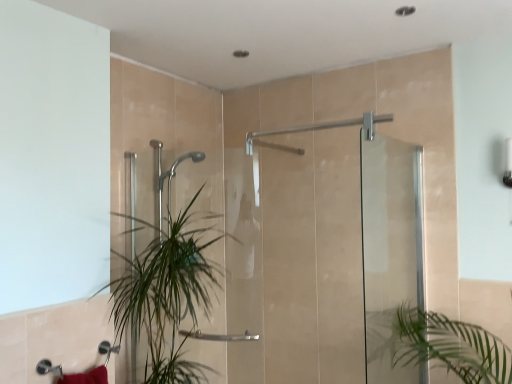
Question: In which direction should I rotate to look at clear glass shower door at center, the first screen door when ordered from left to right?

Choices:
 (A) left
 (B) right

Answer: (A)

Question: From the image's perspective, is transparent glass screen door at right, the 1th screen door in the right-to-left sequence, above green leafy plant at center?

Choices:
 (A) yes
 (B) no

Answer: (A)

Question: From the image's perspective, is transparent glass screen door at right, which is counted as the second screen door, starting from the left, located beneath green leafy plant at center?

Choices:
 (A) yes
 (B) no

Answer: (B)

Question: From a real-world perspective, is transparent glass screen door at right, which is counted as the second screen door, starting from the left, on green leafy plant at center?

Choices:
 (A) no
 (B) yes

Answer: (B)

Question: Is transparent glass screen door at right, the 1th screen door in the right-to-left sequence, behind green leafy plant at center?

Choices:
 (A) no
 (B) yes

Answer: (A)

Question: Is transparent glass screen door at right, which is counted as the second screen door, starting from the left, oriented away from green leafy plant at center?

Choices:
 (A) yes
 (B) no

Answer: (A)

Question: Would you consider clear glass shower door at center, the first screen door when ordered from left to right, to be distant from transparent glass screen door at right, the 1th screen door in the right-to-left sequence?

Choices:
 (A) yes
 (B) no

Answer: (B)

Question: Can you confirm if clear glass shower door at center, which ranks as the second screen door in right-to-left order, is positioned to the left of transparent glass screen door at right, which is counted as the second screen door, starting from the left?

Choices:
 (A) yes
 (B) no

Answer: (A)

Question: From the image's perspective, is clear glass shower door at center, which ranks as the second screen door in right-to-left order, under transparent glass screen door at right, the 1th screen door in the right-to-left sequence?

Choices:
 (A) no
 (B) yes

Answer: (A)

Question: Is clear glass shower door at center, the first screen door when ordered from left to right, not within transparent glass screen door at right, the 1th screen door in the right-to-left sequence?

Choices:
 (A) no
 (B) yes

Answer: (B)

Question: Is clear glass shower door at center, the first screen door when ordered from left to right, positioned with its back to transparent glass screen door at right, the 1th screen door in the right-to-left sequence?

Choices:
 (A) no
 (B) yes

Answer: (B)

Question: Can you confirm if clear glass shower door at center, which ranks as the second screen door in right-to-left order, is wider than transparent glass screen door at right, the 1th screen door in the right-to-left sequence?

Choices:
 (A) yes
 (B) no

Answer: (A)

Question: Is transparent glass screen door at right, the 1th screen door in the right-to-left sequence, smaller than clear glass shower door at center, which ranks as the second screen door in right-to-left order?

Choices:
 (A) no
 (B) yes

Answer: (B)